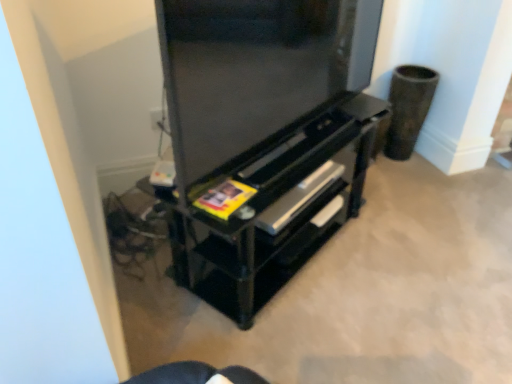
The width and height of the screenshot is (512, 384). In order to click on vacant space underneath black glossy tv stand at center (from a real-world perspective) in this screenshot , I will do `click(285, 153)`.